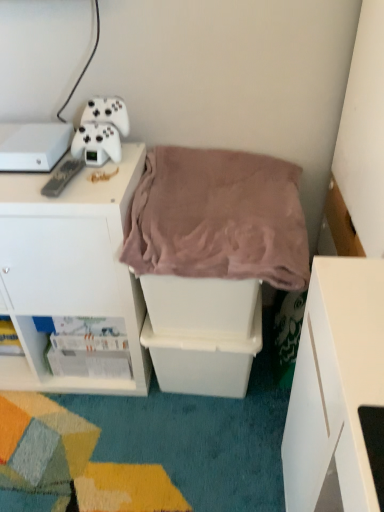
Question: Considering the relative sizes of white plastic storage bin at center, placed as the second shelf when sorted from left to right, and white glossy magazine at lower left, the first shelf positioned from the left, in the image provided, is white plastic storage bin at center, placed as the second shelf when sorted from left to right, wider than white glossy magazine at lower left, the first shelf positioned from the left,?

Choices:
 (A) no
 (B) yes

Answer: (B)

Question: Does white plastic storage bin at center, the first shelf in the right-to-left sequence, turn towards white glossy magazine at lower left, which ranks as the second shelf in right-to-left order?

Choices:
 (A) yes
 (B) no

Answer: (B)

Question: Is white glossy magazine at lower left, the first shelf positioned from the left, surrounded by white plastic storage bin at center, the first shelf in the right-to-left sequence?

Choices:
 (A) yes
 (B) no

Answer: (B)

Question: Is white plastic storage bin at center, placed as the second shelf when sorted from left to right, at the right side of white glossy magazine at lower left, the first shelf positioned from the left?

Choices:
 (A) no
 (B) yes

Answer: (B)

Question: Is white plastic storage bin at center, the first shelf in the right-to-left sequence, further to camera compared to white glossy magazine at lower left, the first shelf positioned from the left?

Choices:
 (A) no
 (B) yes

Answer: (A)

Question: Does white plastic storage bin at center, placed as the second shelf when sorted from left to right, appear on the left side of white glossy magazine at lower left, which ranks as the second shelf in right-to-left order?

Choices:
 (A) no
 (B) yes

Answer: (A)

Question: Is white matte game controller at upper left shorter than black plastic remote at upper left?

Choices:
 (A) no
 (B) yes

Answer: (A)

Question: From a real-world perspective, is white matte game controller at upper left on black plastic remote at upper left?

Choices:
 (A) no
 (B) yes

Answer: (B)

Question: Is white matte game controller at upper left oriented away from black plastic remote at upper left?

Choices:
 (A) yes
 (B) no

Answer: (B)

Question: Considering the relative positions of white matte game controller at upper left and black plastic remote at upper left in the image provided, is white matte game controller at upper left to the right of black plastic remote at upper left from the viewer's perspective?

Choices:
 (A) yes
 (B) no

Answer: (A)

Question: From the image's perspective, is white matte game controller at upper left over black plastic remote at upper left?

Choices:
 (A) yes
 (B) no

Answer: (A)

Question: Considering the relative sizes of white matte game controller at upper left and black plastic remote at upper left in the image provided, is white matte game controller at upper left wider than black plastic remote at upper left?

Choices:
 (A) no
 (B) yes

Answer: (A)

Question: From a real-world perspective, is black plastic remote at upper left on white plastic cabinet at upper left?

Choices:
 (A) yes
 (B) no

Answer: (A)